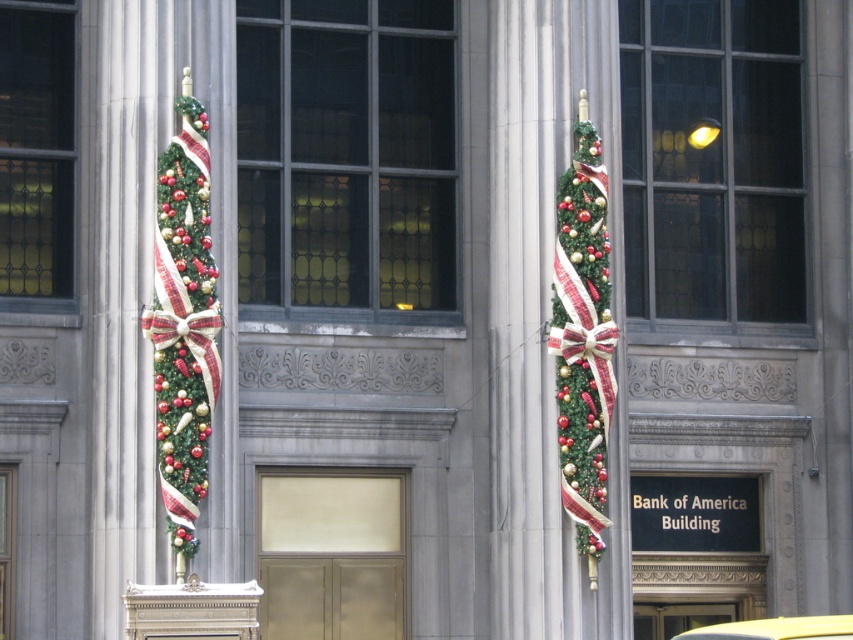
You are a delivery person standing in front of the Bank of America Building. You need to park your yellow matte car at center and place a gift under the green textured christmas tree at right. Can you reach the tree from your current position without moving the car?

The green textured christmas tree at right is above the yellow matte car at center, so you can reach the tree by moving forward from the car since it is positioned above the car and not obstructed.

You are standing in front of the Bank of America Building and looking at its entrance. You notice two points marked on the building facade. The first point is at coordinates point (561, 326) and the second is at point (778, 637). Which point is closer to you?

Point (561, 326) is closer to you because it is further to the viewer than point (778, 637).

You are a delivery driver who needs to park your yellow matte car at center close to the green textured wreath at left for a photo. Given that the parking space is 12 meters long, will your car fit between the wreath and the building entrance without overlapping?

The green textured wreath at left and yellow matte car at center are 11.69 meters apart. Since the parking space is 12 meters long, the yellow matte car at center can fit between the wreath and the building entrance as there is enough space.